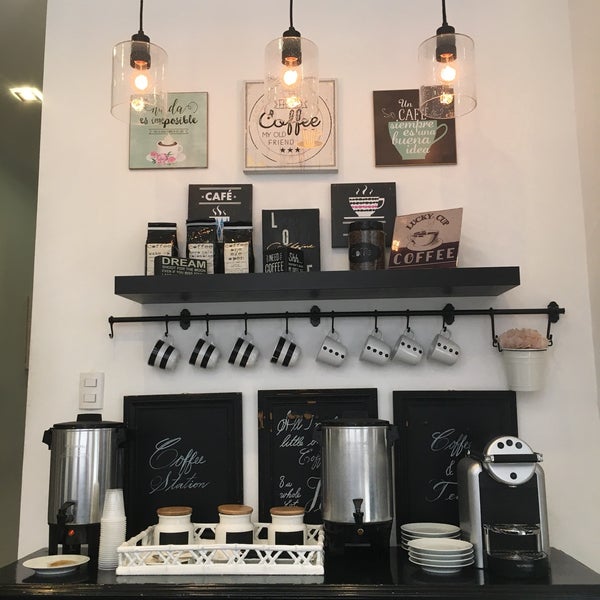
Where is `white light switches`? This screenshot has height=600, width=600. white light switches is located at coordinates (93, 382), (92, 395).